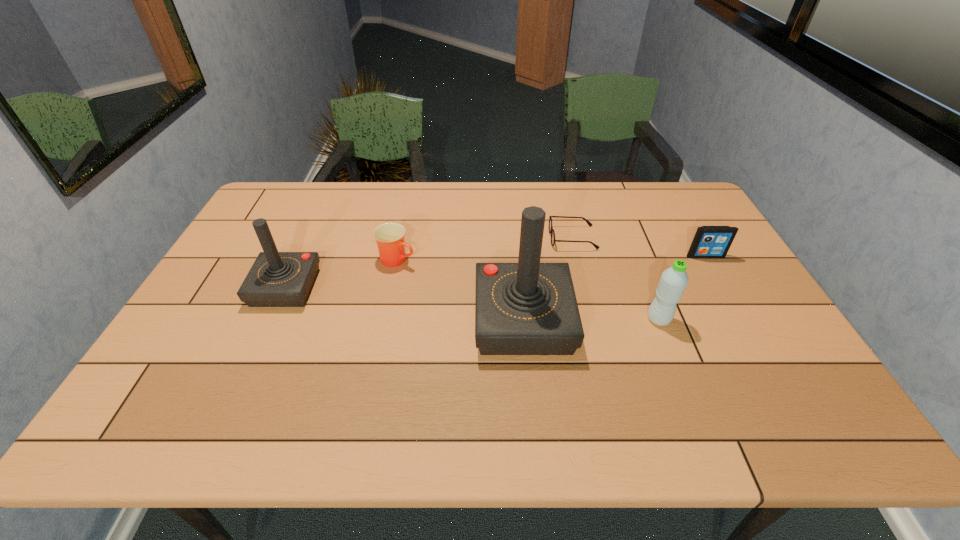
At what (x,y) coordinates should I click in order to perform the action: click on vacant space located on the rectangular base of the shorter joystick. Please return your answer as a coordinate pair (x, y). Looking at the image, I should click on (231, 287).

Locate an element on the screen. The image size is (960, 540). free space located on the front of the cup is located at coordinates (389, 299).

Image resolution: width=960 pixels, height=540 pixels. In order to click on vacant area situated on the front-facing side of the shortest object in this screenshot , I will do `click(451, 238)`.

Identify the location of vacant space located 0.160m on the front-facing side of the shortest object. This screenshot has width=960, height=540. (500, 238).

You are a GUI agent. You are given a task and a screenshot of the screen. Output one action in this format:
    pyautogui.click(x=<x>, y=<y>)
    Task: Click on the vacant area situated 0.300m on the front-facing side of the shortest object
    
    Given the screenshot: What is the action you would take?
    pyautogui.click(x=457, y=238)

Image resolution: width=960 pixels, height=540 pixels. Identify the location of vacant space located 0.080m on the back of the fourth shortest object. coord(647,290).

Where is `free region located on the front screen of the iPod`? free region located on the front screen of the iPod is located at coordinates (726, 291).

Identify the location of object present at the left edge. (276, 279).

Locate an element on the screen. The image size is (960, 540). object present at the right edge is located at coordinates (709, 241).

This screenshot has height=540, width=960. I want to click on free region at the far edge of the desktop, so click(451, 186).